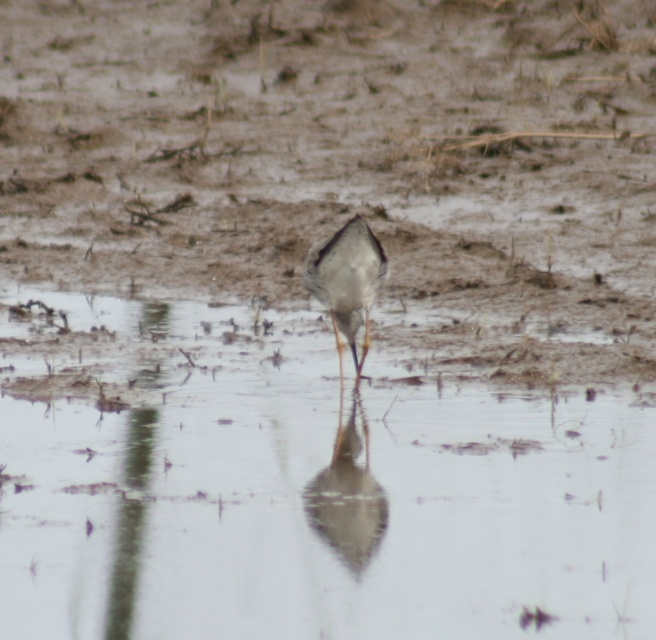
What are the coordinates of the smooth gray bird at center?

The smooth gray bird at center is located at point (348, 496).

You are a photographer trying to capture the reflection of the bird in the water. You notice a point marked at coordinates (x=302, y=486). Based on the scene description, where is this point located in relation to the bird?

The point at (x=302, y=486) marks clear water at center, so it is located at the center of the scene where the calm water reflects the bird.